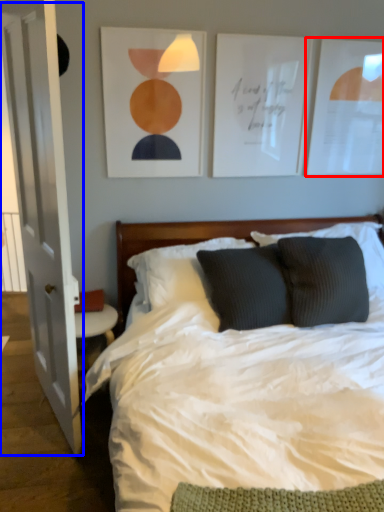
Question: Which of the following is the closest to the observer, picture frame (highlighted by a red box) or glass door (highlighted by a blue box)?

Choices:
 (A) picture frame
 (B) glass door

Answer: (B)